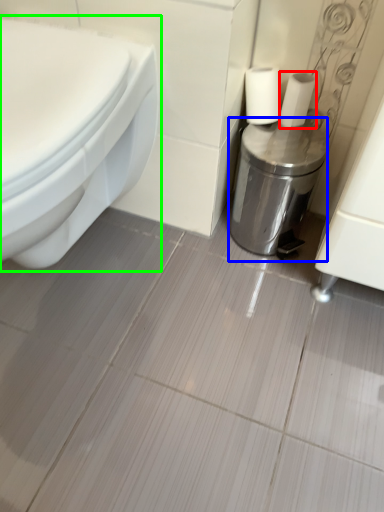
Question: Which is farther away from toilet paper (highlighted by a red box)? dispenser (highlighted by a blue box) or toilet (highlighted by a green box)?

Choices:
 (A) dispenser
 (B) toilet

Answer: (B)